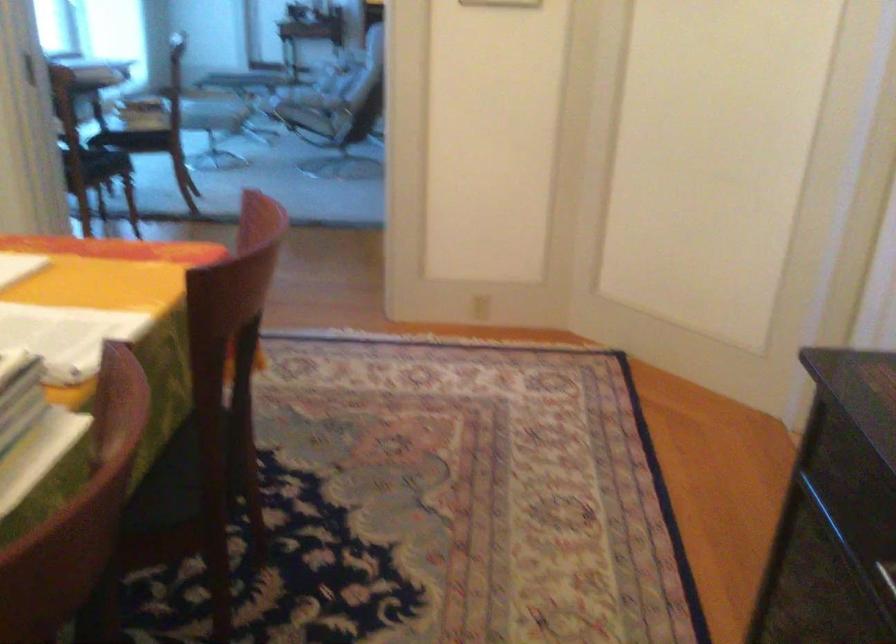
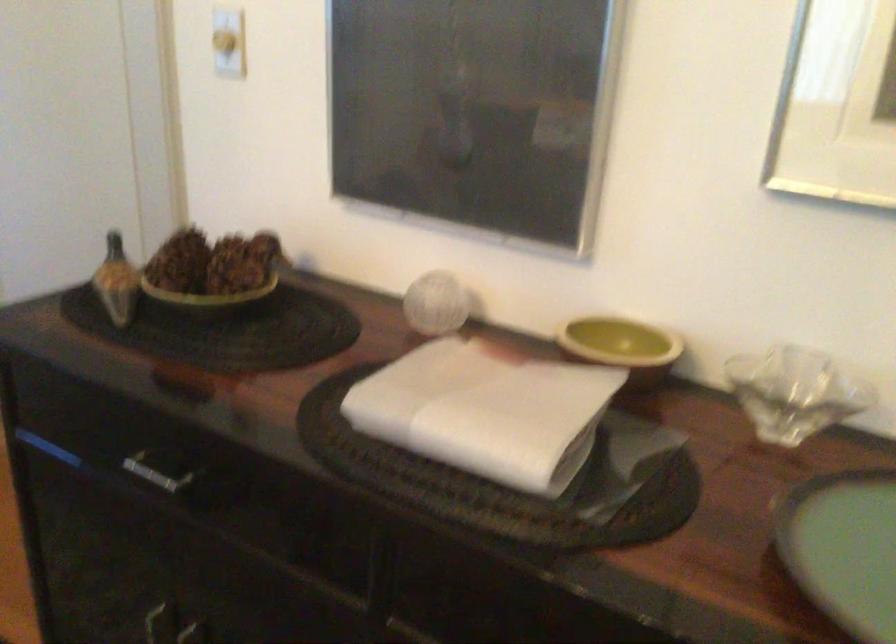
Question: How did the camera likely rotate?

Choices:
 (A) Left
 (B) Right
 (C) Up
 (D) Down

Answer: (B)